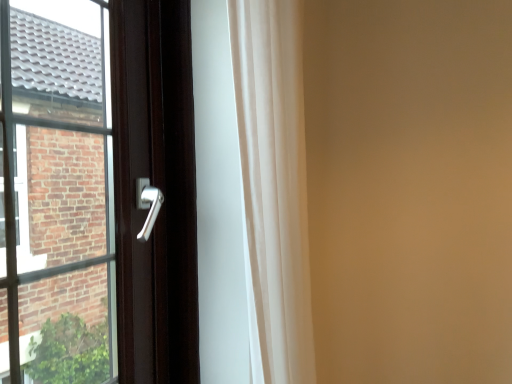
Image resolution: width=512 pixels, height=384 pixels. What do you see at coordinates (273, 187) in the screenshot? I see `white silky curtain at center` at bounding box center [273, 187].

You are a GUI agent. You are given a task and a screenshot of the screen. Output one action in this format:
    pyautogui.click(x=<x>, y=<y>)
    Task: Click on the white silky curtain at center
    
    Given the screenshot: What is the action you would take?
    pyautogui.click(x=273, y=187)

The width and height of the screenshot is (512, 384). In order to click on white silky curtain at center in this screenshot , I will do `click(273, 187)`.